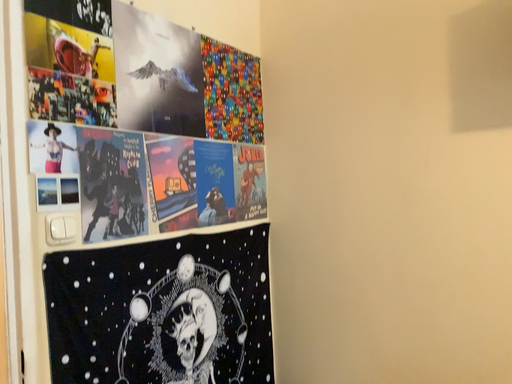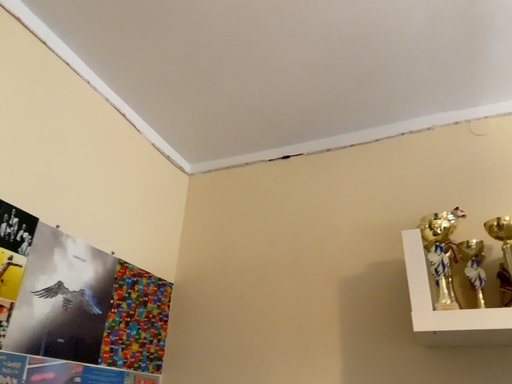
Question: How did the camera likely rotate when shooting the video?

Choices:
 (A) rotated upward
 (B) rotated downward

Answer: (A)